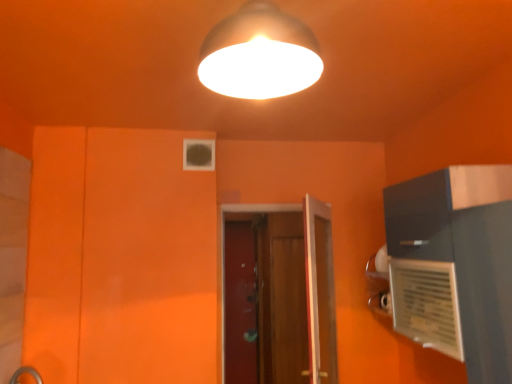
Find the location of a particular element. Image resolution: width=512 pixels, height=384 pixels. matte white lampshade at upper center is located at coordinates (259, 54).

You are a GUI agent. You are given a task and a screenshot of the screen. Output one action in this format:
    pyautogui.click(x=<x>, y=<y>)
    Task: Click on the transparent glass screen door at center, which is the 1th screen door in left-to-right order
    
    Given the screenshot: What is the action you would take?
    [240, 303]

Locate an element on the screen. This screenshot has width=512, height=384. wooden door at center is located at coordinates (277, 294).

In order to click on wooden screen door at center, which appears as the 2th screen door when viewed from the left in this screenshot , I will do `click(287, 299)`.

At what (x,y) coordinates should I click in order to perform the action: click on matte white lampshade at upper center. Please return your answer as a coordinate pair (x, y). This screenshot has height=384, width=512. Looking at the image, I should click on (259, 54).

Considering the sizes of objects wooden screen door at center, which is the first screen door in right-to-left order, and matte white lampshade at upper center in the image provided, who is shorter, wooden screen door at center, which is the first screen door in right-to-left order, or matte white lampshade at upper center?

matte white lampshade at upper center.

Locate an element on the screen. The width and height of the screenshot is (512, 384). the 1st screen door behind the matte white lampshade at upper center, starting your count from the anchor is located at coordinates (287, 299).

Can we say wooden screen door at center, which is the first screen door in right-to-left order, lies outside matte white lampshade at upper center?

Indeed, wooden screen door at center, which is the first screen door in right-to-left order, is completely outside matte white lampshade at upper center.

Is wooden screen door at center, which appears as the 2th screen door when viewed from the left, in front of or behind matte white lampshade at upper center in the image?

Visually, wooden screen door at center, which appears as the 2th screen door when viewed from the left, is located behind matte white lampshade at upper center.

This screenshot has width=512, height=384. I want to click on lamp above the wooden door at center (from the image's perspective), so click(x=259, y=54).

Between wooden door at center and matte white lampshade at upper center, which one has smaller width?

Thinner between the two is wooden door at center.

How different are the orientations of wooden door at center and matte white lampshade at upper center in degrees?

179 degrees.

In the scene shown: Considering the relative positions of wooden door at center and matte white lampshade at upper center in the image provided, is wooden door at center to the right of matte white lampshade at upper center from the viewer's perspective?

Yes.

Which is correct: transparent glass screen door at center, which appears as the second screen door when viewed from the right, is inside wooden door at center, or outside of it?

transparent glass screen door at center, which appears as the second screen door when viewed from the right, is not enclosed by wooden door at center.

Between point (234, 332) and point (289, 249), which one is positioned in front?

The point (289, 249) is closer.

Identify the location of door located on the right of transparent glass screen door at center, which appears as the second screen door when viewed from the right. (277, 294).

From the image's perspective, is transparent glass screen door at center, which appears as the second screen door when viewed from the right, located beneath wooden door at center?

Yes, from the image's perspective, transparent glass screen door at center, which appears as the second screen door when viewed from the right, is below wooden door at center.

Who is taller, matte white lampshade at upper center or wooden door at center?

Standing taller between the two is wooden door at center.

Find the location of a particular element. The height and width of the screenshot is (384, 512). door behind the matte white lampshade at upper center is located at coordinates (277, 294).

From the picture: Is matte white lampshade at upper center touching wooden door at center?

matte white lampshade at upper center and wooden door at center are clearly separated.

Does point (223, 40) come farther from viewer compared to point (260, 305)?

No, it is in front of (260, 305).

Which object is further away from the camera taking this photo, transparent glass screen door at center, which is the 1th screen door in left-to-right order, or matte white lampshade at upper center?

transparent glass screen door at center, which is the 1th screen door in left-to-right order, is further away from the camera.

Is transparent glass screen door at center, which is the 1th screen door in left-to-right order, not within matte white lampshade at upper center?

Yes, transparent glass screen door at center, which is the 1th screen door in left-to-right order, is not within matte white lampshade at upper center.

From a real-world perspective, which is physically below, wooden door at center or wooden screen door at center, which is the first screen door in right-to-left order?

wooden screen door at center, which is the first screen door in right-to-left order, is physically lower.

Are wooden door at center and wooden screen door at center, which appears as the 2th screen door when viewed from the left, located far from each other?

No, there isn't a large distance between wooden door at center and wooden screen door at center, which appears as the 2th screen door when viewed from the left.

Could you measure the distance between wooden door at center and wooden screen door at center, which is the first screen door in right-to-left order?

wooden door at center and wooden screen door at center, which is the first screen door in right-to-left order, are 5.29 inches apart.

Is wooden door at center taller or shorter than wooden screen door at center, which appears as the 2th screen door when viewed from the left?

Considering their sizes, wooden door at center has less height than wooden screen door at center, which appears as the 2th screen door when viewed from the left.

Based on their sizes in the image, would you say matte white lampshade at upper center is bigger or smaller than wooden screen door at center, which is the first screen door in right-to-left order?

Considering their sizes, matte white lampshade at upper center takes up less space than wooden screen door at center, which is the first screen door in right-to-left order.

Locate an element on the screen. Image resolution: width=512 pixels, height=384 pixels. the 1st screen door positioned below the matte white lampshade at upper center (from a real-world perspective) is located at coordinates (287, 299).

Does point (207, 85) come farther from viewer compared to point (273, 269)?

That is False.

Between matte white lampshade at upper center and wooden screen door at center, which appears as the 2th screen door when viewed from the left, which one has smaller width?

matte white lampshade at upper center.

Where is `screen door to the right of matte white lampshade at upper center`? This screenshot has width=512, height=384. screen door to the right of matte white lampshade at upper center is located at coordinates (287, 299).

Locate an element on the screen. door below the matte white lampshade at upper center (from the image's perspective) is located at coordinates (277, 294).

From the image, which object appears to be nearer to transparent glass screen door at center, which appears as the second screen door when viewed from the right, wooden screen door at center, which is the first screen door in right-to-left order, or wooden door at center?

wooden door at center lies closer to transparent glass screen door at center, which appears as the second screen door when viewed from the right, than the other object.

From the image, which object appears to be nearer to matte white lampshade at upper center, transparent glass screen door at center, which is the 1th screen door in left-to-right order, or wooden door at center?

The object closer to matte white lampshade at upper center is wooden door at center.

Looking at the image, which one is located further to wooden screen door at center, which appears as the 2th screen door when viewed from the left, wooden door at center or matte white lampshade at upper center?

matte white lampshade at upper center.

When comparing their distances from matte white lampshade at upper center, does wooden screen door at center, which is the first screen door in right-to-left order, or wooden door at center seem further?

wooden door at center is positioned further to the anchor matte white lampshade at upper center.

When comparing their distances from wooden door at center, does wooden screen door at center, which appears as the 2th screen door when viewed from the left, or transparent glass screen door at center, which appears as the second screen door when viewed from the right, seem further?

The object further to wooden door at center is transparent glass screen door at center, which appears as the second screen door when viewed from the right.

Which object lies nearer to the anchor point transparent glass screen door at center, which appears as the second screen door when viewed from the right, matte white lampshade at upper center or wooden screen door at center, which is the first screen door in right-to-left order?

Among the two, wooden screen door at center, which is the first screen door in right-to-left order, is located nearer to transparent glass screen door at center, which appears as the second screen door when viewed from the right.

Which object lies nearer to the anchor point transparent glass screen door at center, which appears as the second screen door when viewed from the right, wooden door at center or matte white lampshade at upper center?

The object closer to transparent glass screen door at center, which appears as the second screen door when viewed from the right, is wooden door at center.

From the image, which object appears to be nearer to wooden door at center, matte white lampshade at upper center or wooden screen door at center, which is the first screen door in right-to-left order?

Based on the image, wooden screen door at center, which is the first screen door in right-to-left order, appears to be nearer to wooden door at center.

At what (x,y) coordinates should I click in order to perform the action: click on door between matte white lampshade at upper center and wooden screen door at center, which is the first screen door in right-to-left order, along the z-axis. Please return your answer as a coordinate pair (x, y). This screenshot has height=384, width=512. Looking at the image, I should click on (277, 294).

Where is `door between matte white lampshade at upper center and transparent glass screen door at center, which appears as the second screen door when viewed from the right, in the front-back direction`? The image size is (512, 384). door between matte white lampshade at upper center and transparent glass screen door at center, which appears as the second screen door when viewed from the right, in the front-back direction is located at coordinates (277, 294).

Locate an element on the screen. Image resolution: width=512 pixels, height=384 pixels. screen door between wooden door at center and transparent glass screen door at center, which appears as the second screen door when viewed from the right, in the front-back direction is located at coordinates point(287,299).

The width and height of the screenshot is (512, 384). In order to click on screen door between matte white lampshade at upper center and transparent glass screen door at center, which is the 1th screen door in left-to-right order, in the front-back direction in this screenshot , I will do `click(287, 299)`.